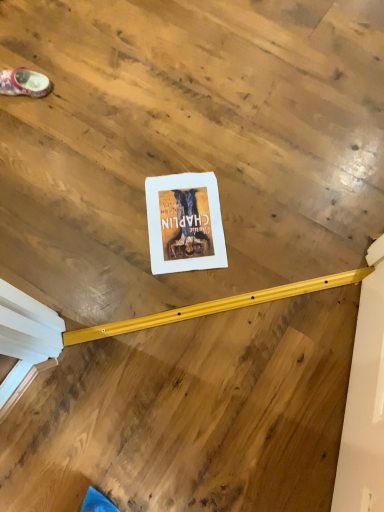
Identify the location of vacant area that is situated to the right of white paper at center. (264, 219).